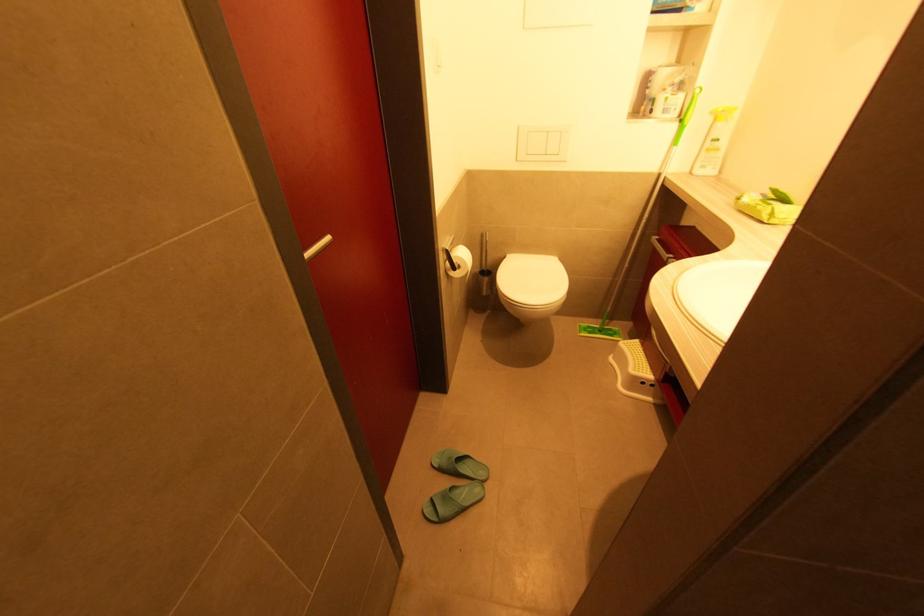
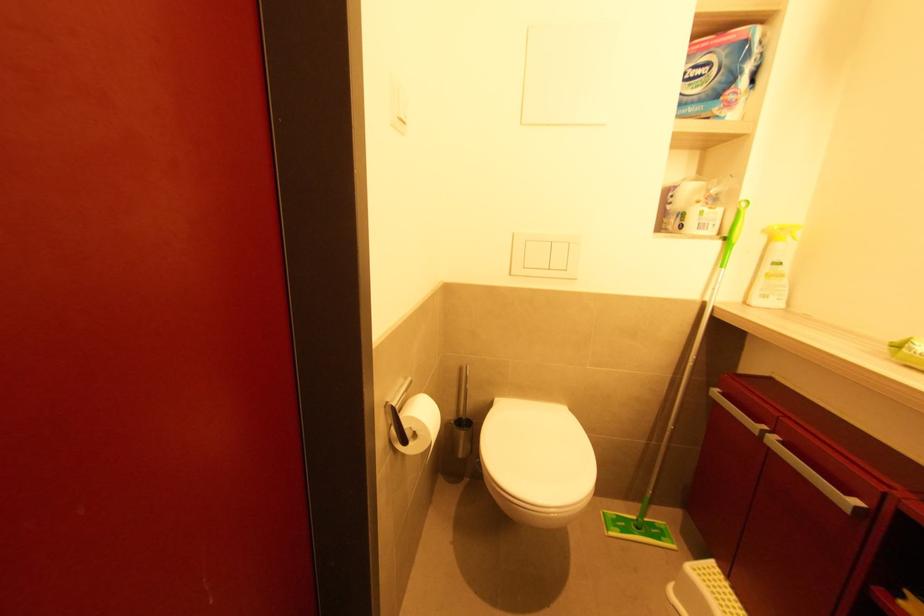
Question: The images are taken continuously from a first-person perspective. In which direction is your viewpoint rotating?

Choices:
 (A) Left
 (B) Right
 (C) Up
 (D) Down

Answer: (C)